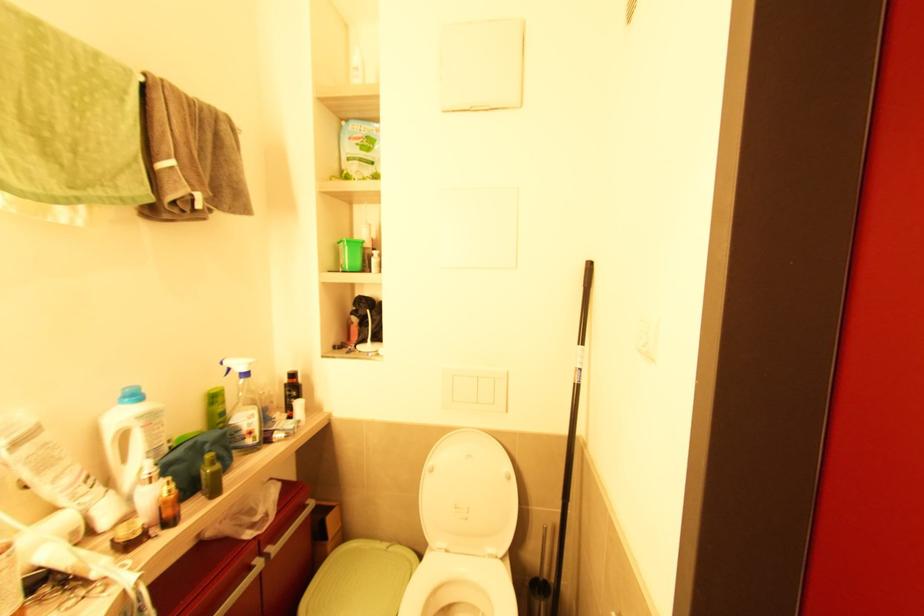
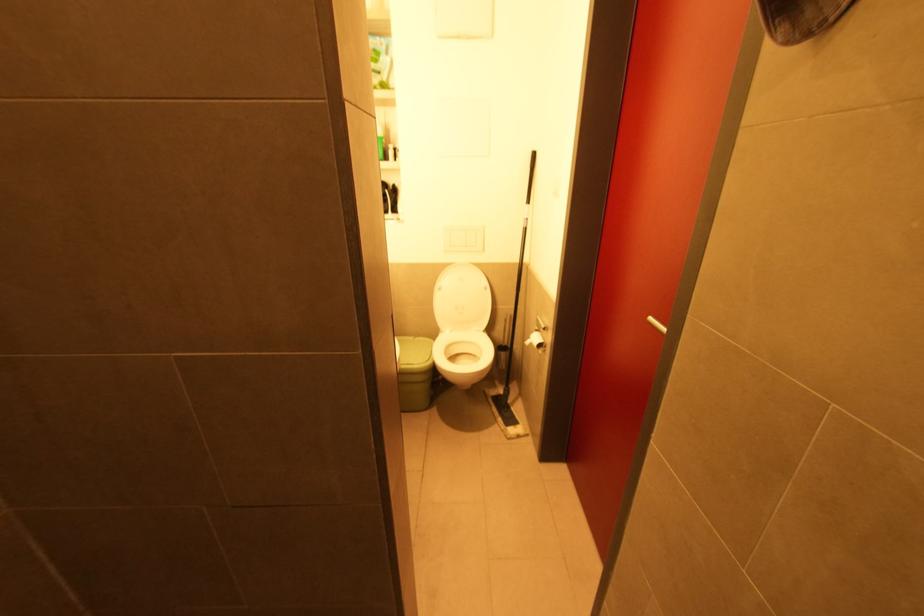
Question: In a continuous first-person perspective shot, in which direction is the camera moving?

Choices:
 (A) Left
 (B) Right
 (C) Forward
 (D) Backward

Answer: (D)